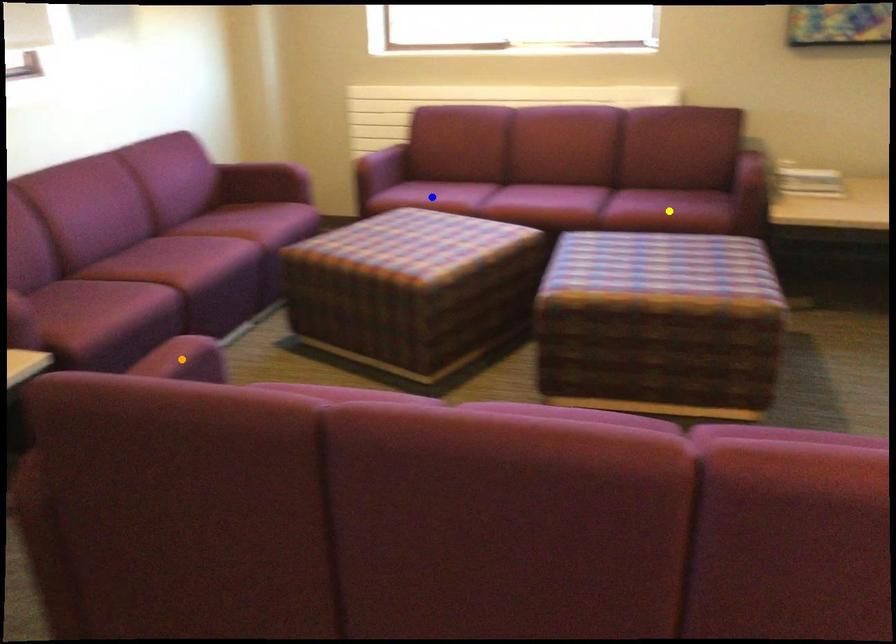
Order these from nearest to farthest:
- orange point
- blue point
- yellow point

orange point
yellow point
blue point